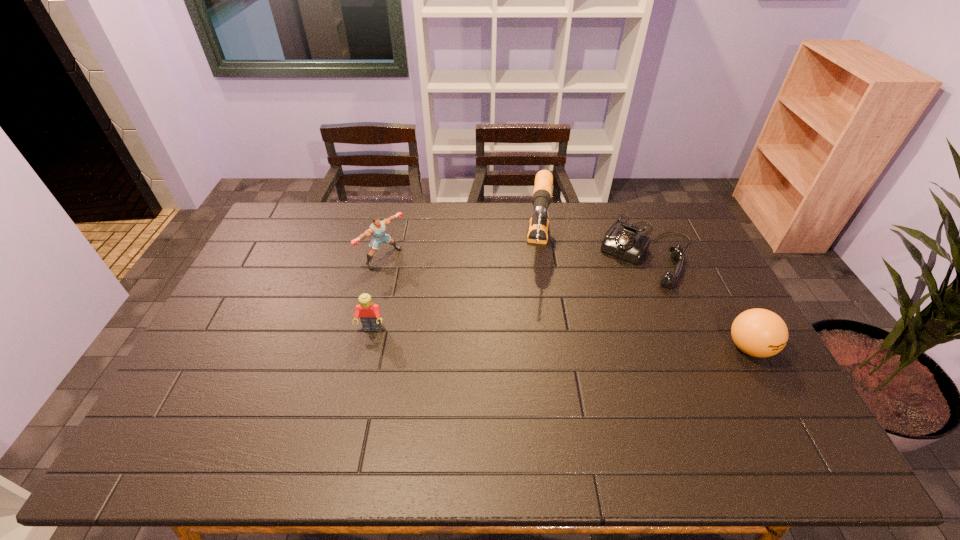
Where is `free space on the desktop that is between the Lego and the ping-pong ball and is positioned on the dial of the telephone`? The width and height of the screenshot is (960, 540). free space on the desktop that is between the Lego and the ping-pong ball and is positioned on the dial of the telephone is located at coordinates (594, 340).

Identify the location of vacant space on the desktop that is between the Lego and the ping-pong ball and is positioned on the handle side of the third object from left to right. This screenshot has height=540, width=960. (530, 336).

The image size is (960, 540). In order to click on vacant space on the desktop that is between the Lego and the ping-pong ball and is positioned on the front-facing side of the puncher in this screenshot , I will do `click(506, 335)`.